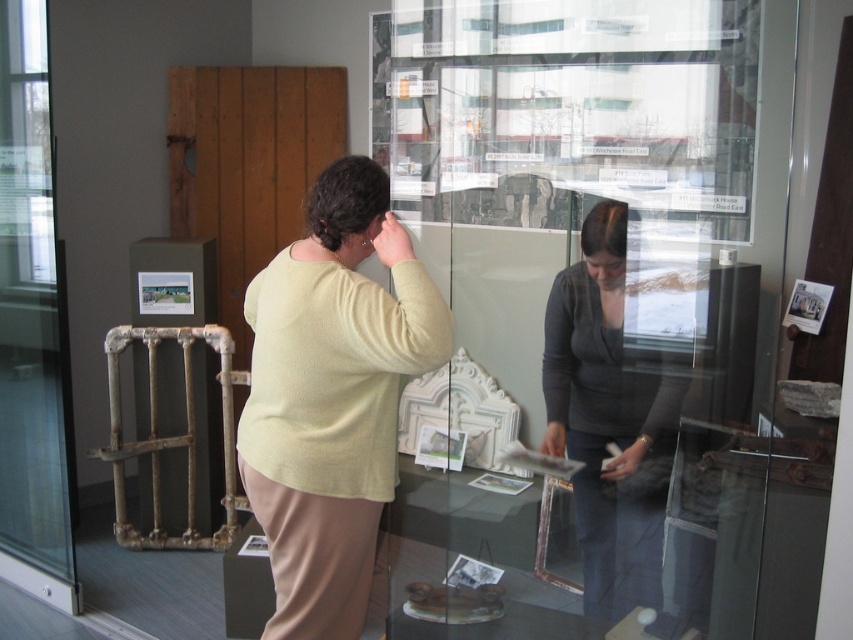
Which is more to the left, transparent glass door at center or light yellow sweater at center?

Positioned to the left is light yellow sweater at center.

Does transparent glass door at center have a smaller size compared to light yellow sweater at center?

Incorrect, transparent glass door at center is not smaller in size than light yellow sweater at center.

Identify the location of transparent glass door at center. (593, 310).

Can you confirm if light yellow sweater at center is positioned above dark gray sweater at center?

Yes.

Does light yellow sweater at center have a lesser height compared to dark gray sweater at center?

Correct, light yellow sweater at center is not as tall as dark gray sweater at center.

Locate an element on the screen. The height and width of the screenshot is (640, 853). light yellow sweater at center is located at coordinates (332, 396).

Image resolution: width=853 pixels, height=640 pixels. What are the coordinates of `light yellow sweater at center` in the screenshot? It's located at (332, 396).

Does point (712, 138) lie behind point (44, 515)?

Yes, point (712, 138) is farther from viewer.

Does point (579, 385) come closer to viewer compared to point (47, 172)?

Yes.

Where is `transparent glass door at center`? transparent glass door at center is located at coordinates (593, 310).

Find the location of a particular element. Image resolution: width=853 pixels, height=640 pixels. transparent glass door at center is located at coordinates (593, 310).